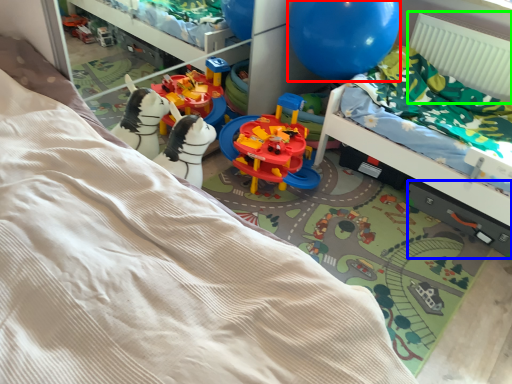
Question: Estimate the real-world distances between objects in this image. Which object is closer to balloon (highlighted by a red box), drawer (highlighted by a blue box) or radiator (highlighted by a green box)?

Choices:
 (A) drawer
 (B) radiator

Answer: (B)